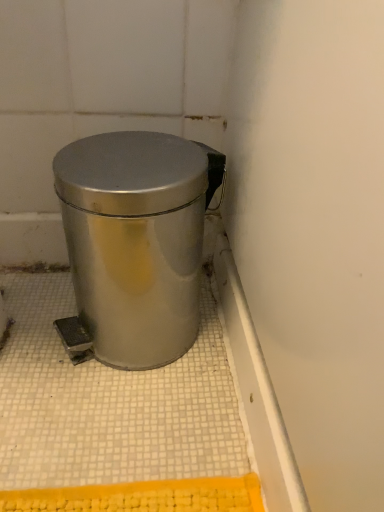
I want to click on satin silver trash can at center, so click(134, 243).

What do you see at coordinates (134, 243) in the screenshot?
I see `satin silver trash can at center` at bounding box center [134, 243].

Measure the distance between satin silver trash can at center and camera.

satin silver trash can at center and camera are 39.99 centimeters apart.

What is the approximate height of satin silver trash can at center?

It is 11.18 inches.

I want to click on satin silver trash can at center, so click(x=134, y=243).